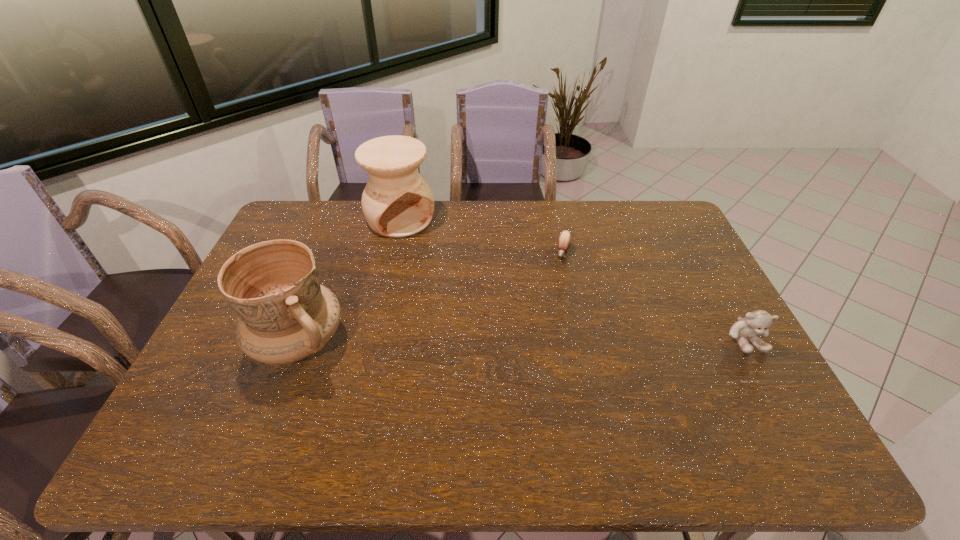
Identify the location of vacant point located 0.130m at the open side of the farther pottery. This screenshot has width=960, height=540. click(x=434, y=256).

At what (x,y) coordinates should I click in order to perform the action: click on free space located on the front-facing side of the second farthest object. Please return your answer as a coordinate pair (x, y). Looking at the image, I should click on (551, 303).

What are the coordinates of `free point located 0.170m on the front-facing side of the second farthest object` in the screenshot? It's located at (552, 299).

Locate an element on the screen. This screenshot has width=960, height=540. free region located on the front-facing side of the second farthest object is located at coordinates (551, 301).

You are a GUI agent. You are given a task and a screenshot of the screen. Output one action in this format:
    pyautogui.click(x=<x>, y=<y>)
    Task: Click on the object located at the far edge
    The height and width of the screenshot is (540, 960).
    Given the screenshot: What is the action you would take?
    pyautogui.click(x=397, y=202)

Identify the location of object present at the left edge. The height and width of the screenshot is (540, 960). click(285, 315).

This screenshot has height=540, width=960. I want to click on object that is at the right edge, so click(x=757, y=322).

Locate an element on the screen. This screenshot has height=540, width=960. free space at the far edge of the desktop is located at coordinates (540, 237).

In the image, there is a desktop. What are the coordinates of `vacant space at the near edge` in the screenshot? It's located at (446, 398).

At what (x,y) coordinates should I click in order to perform the action: click on blank space at the left edge of the desktop. Please return your answer as a coordinate pair (x, y). This screenshot has height=540, width=960. Looking at the image, I should click on (214, 379).